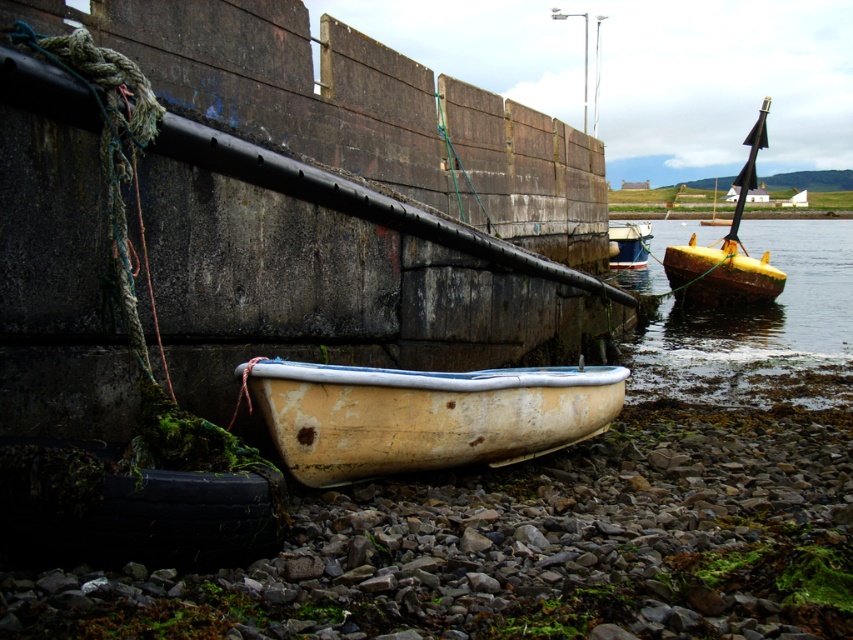
Question: Which of the following is the farthest from the observer?

Choices:
 (A) (640, 243)
 (B) (314, 369)

Answer: (A)

Question: Among these objects, which one is farthest from the camera?

Choices:
 (A) yellow wooden boat at right
 (B) white plastic boat at center
 (C) rusty metallic boat at right
 (D) rusty wood boat at lower center

Answer: (B)

Question: Is yellow wooden boat at right positioned behind white plastic boat at center?

Choices:
 (A) no
 (B) yes

Answer: (A)

Question: Is rusty wood boat at lower center to the left of white plastic boat at center from the viewer's perspective?

Choices:
 (A) no
 (B) yes

Answer: (B)

Question: Among these objects, which one is nearest to the camera?

Choices:
 (A) rusty metallic boat at right
 (B) white plastic boat at center

Answer: (A)

Question: Can you confirm if rusty wood boat at lower center is wider than yellow wooden boat at right?

Choices:
 (A) yes
 (B) no

Answer: (B)